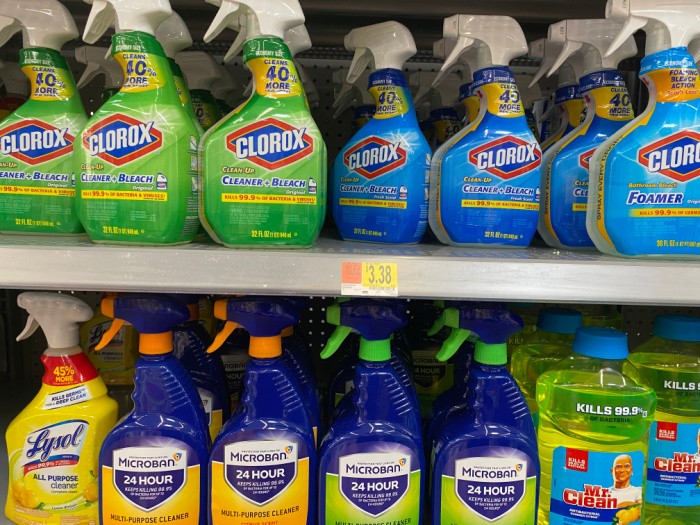
At what (x,y) coordinates should I click in order to perform the action: click on spray bottle. Please return your answer as a coordinate pair (x, y). Looking at the image, I should click on (374, 330).